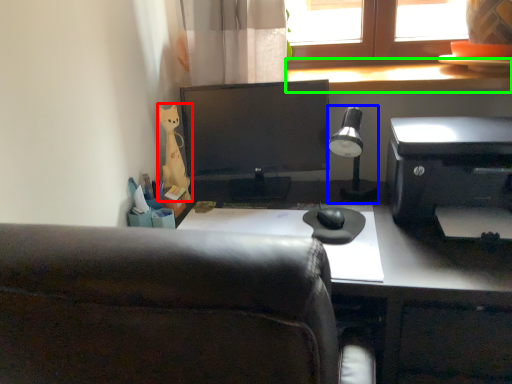
Question: Which is nearer to the stationery (highlighted by a red box)? lamp (highlighted by a blue box) or window sill (highlighted by a green box).

Choices:
 (A) lamp
 (B) window sill

Answer: (A)